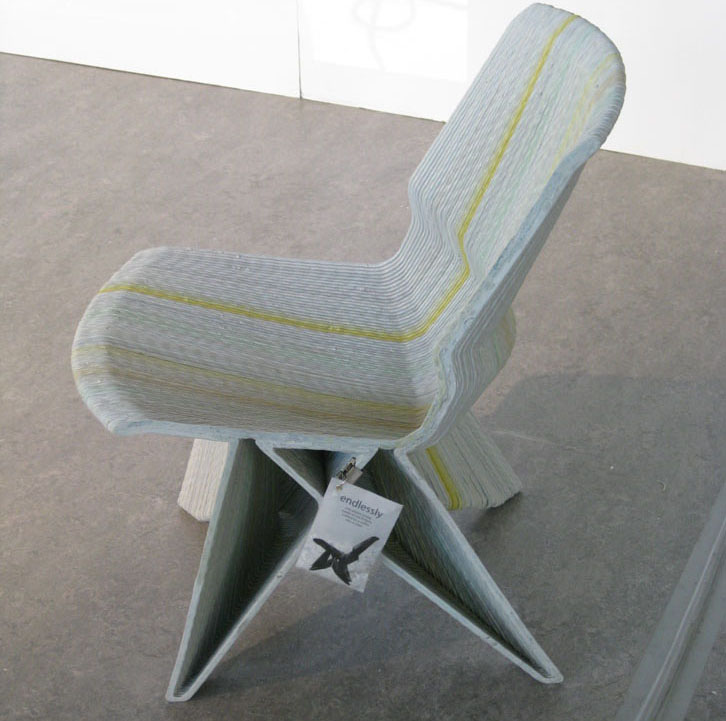
Where is `chair`? Image resolution: width=726 pixels, height=721 pixels. chair is located at coordinates click(x=325, y=337).